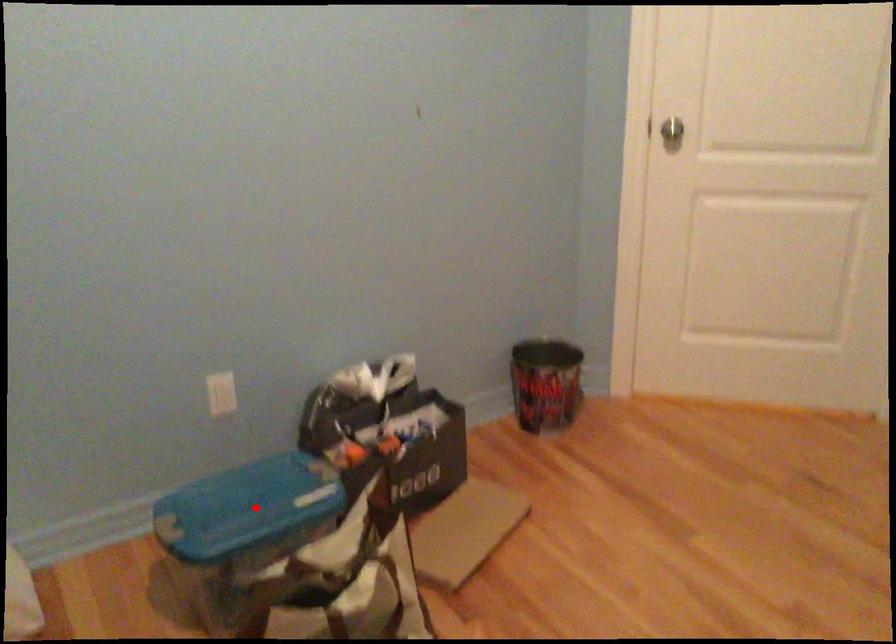
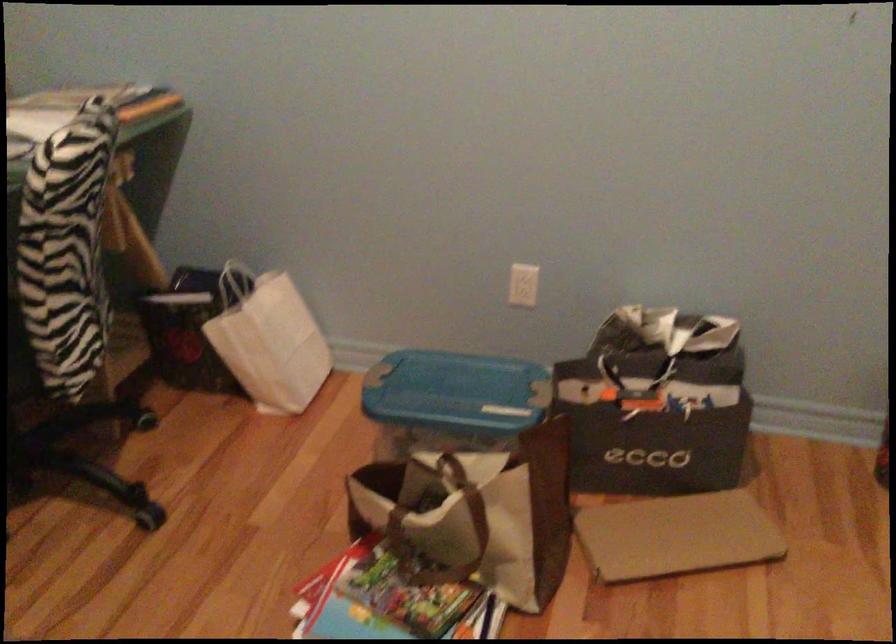
Locate, in the second image, the point that corresponds to the highlighted location in the first image.

(455, 393)